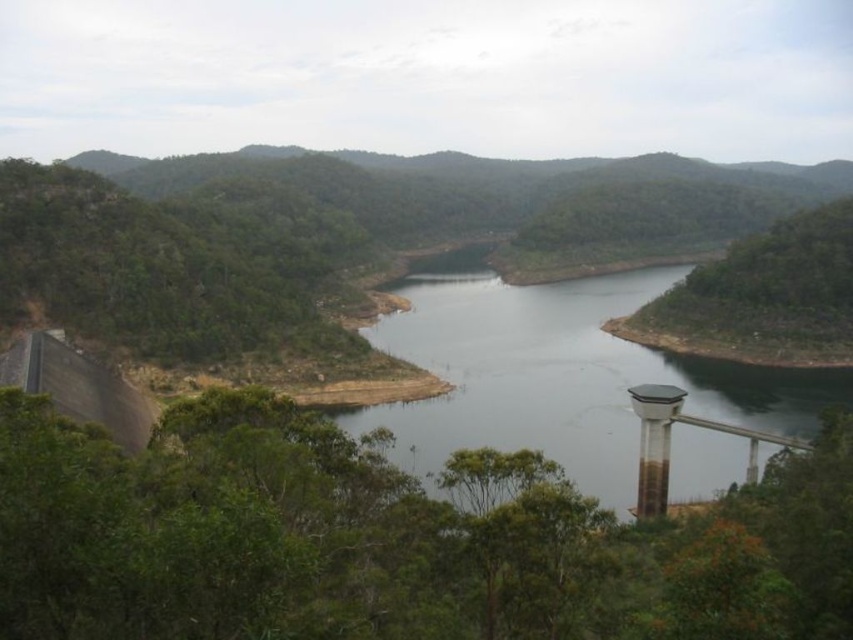
You are a photographer positioned at the base of the metallic gray water tower at lower right. You want to capture a shot of the dark gray concrete river at center. Based on their spatial relationship, will the river appear closer to or farther from the camera compared to the water tower in the photo?

The dark gray concrete river at center is in front of the metallic gray water tower at lower right, so in the photo, the river will appear closer to the camera than the water tower.

You are a photographer planning to capture a wide shot of the dark gray concrete river at center and the metallic gray water tower at lower right. Given their sizes, which object should you prioritize framing closer to the center of your composition to ensure both are adequately visible?

The dark gray concrete river at center should be prioritized closer to the center of the composition since it has a larger size compared to the metallic gray water tower at lower right, ensuring both objects are adequately visible.